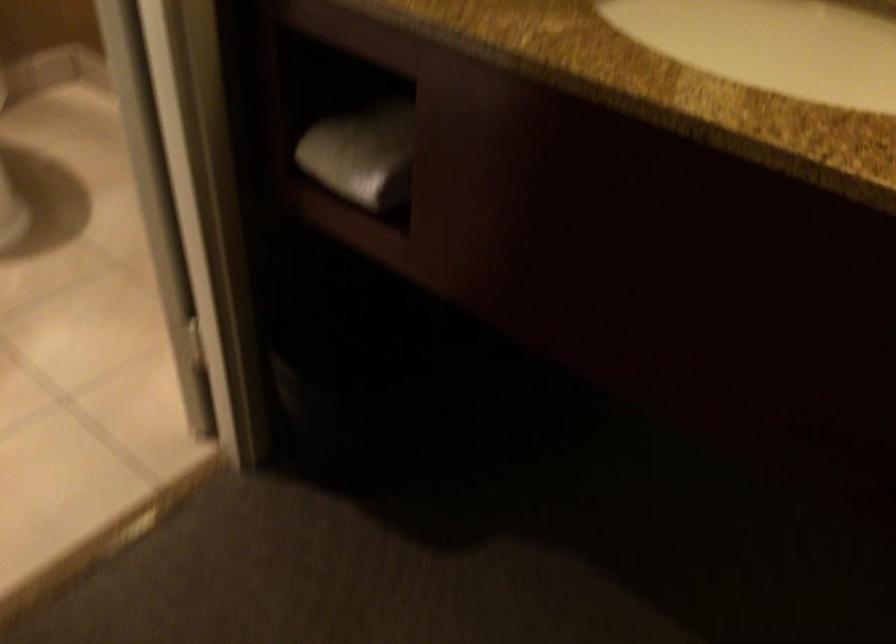
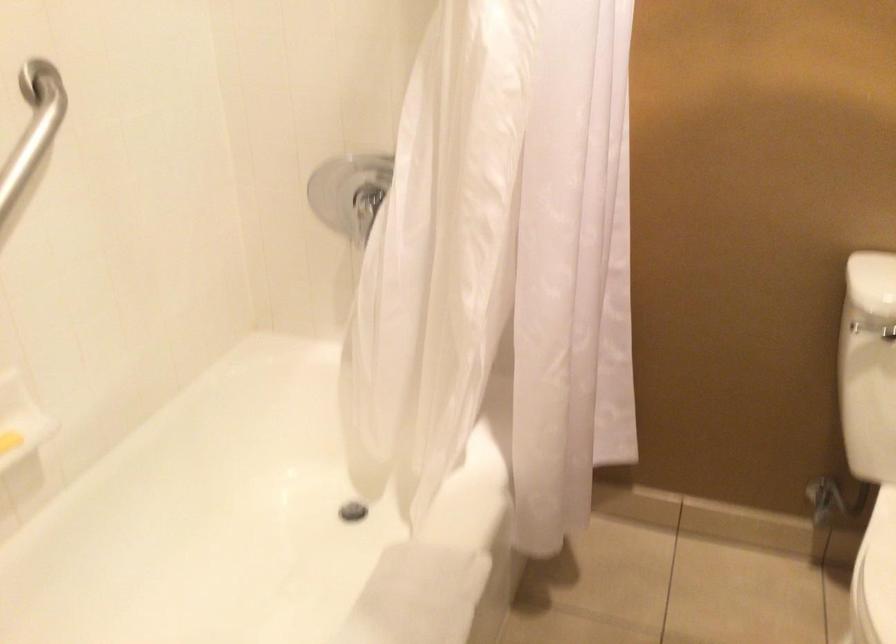
Question: The camera is either moving clockwise (left) or counter-clockwise (right) around the object. The first image is from the beginning of the video and the second image is from the end. Is the camera moving left or right when shooting the video?

Choices:
 (A) Left
 (B) Right

Answer: (B)